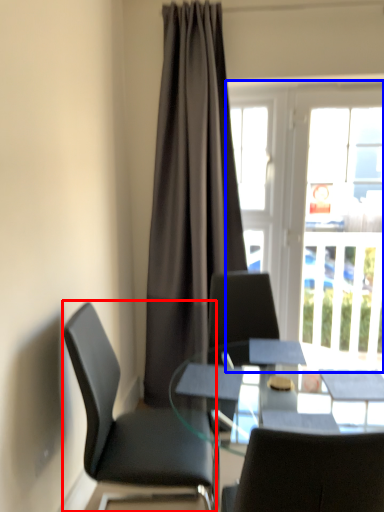
Question: Which object is further to the camera taking this photo, chair (highlighted by a red box) or window (highlighted by a blue box)?

Choices:
 (A) chair
 (B) window

Answer: (B)